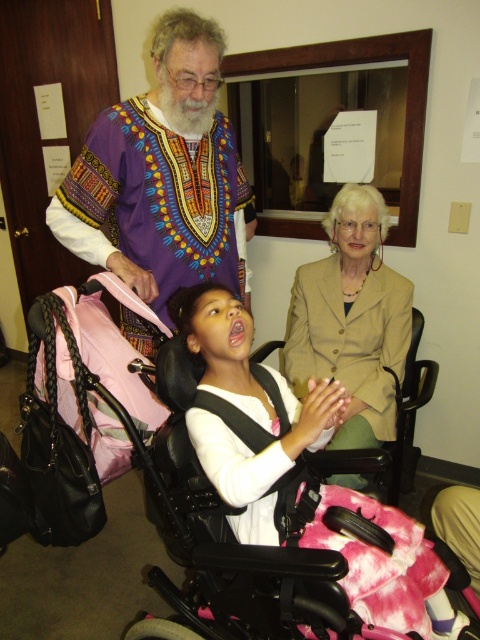
Question: Does pink fabric baby carriage at lower center have a lesser width compared to beige fabric jacket at center?

Choices:
 (A) no
 (B) yes

Answer: (A)

Question: Among these points, which one is farthest from the camera?

Choices:
 (A) (380, 227)
 (B) (120, 138)
 (C) (124, 412)

Answer: (A)

Question: Which of the following is the farthest from the observer?

Choices:
 (A) (343, 340)
 (B) (156, 252)
 (C) (45, 298)

Answer: (A)

Question: Which object is the closest to the pink fabric baby carriage at lower center?

Choices:
 (A) purple printed shirt at upper left
 (B) beige fabric jacket at center

Answer: (A)

Question: Considering the relative positions of pink fabric baby carriage at lower center and beige fabric jacket at center in the image provided, where is pink fabric baby carriage at lower center located with respect to beige fabric jacket at center?

Choices:
 (A) above
 (B) below

Answer: (B)

Question: Is purple printed shirt at upper left thinner than beige fabric jacket at center?

Choices:
 (A) no
 (B) yes

Answer: (A)